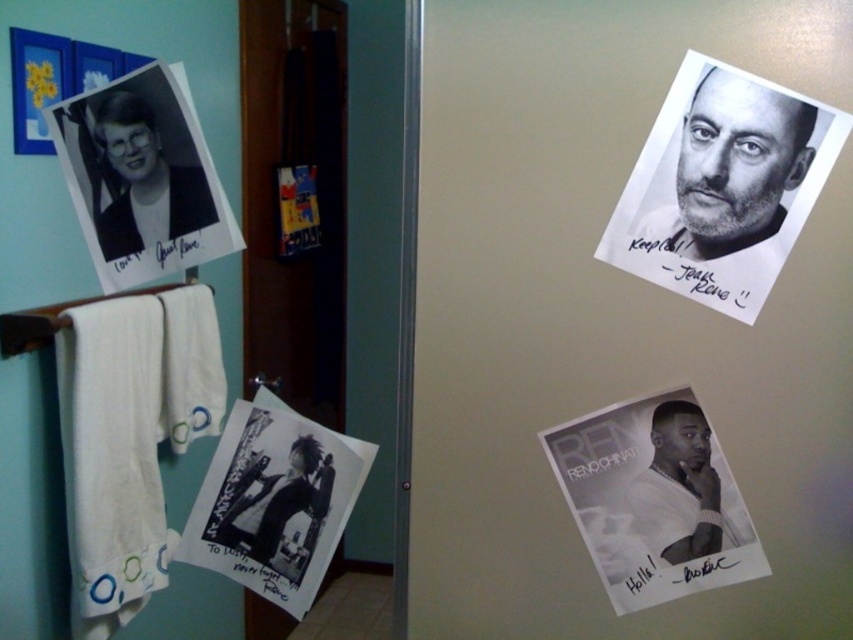
What is the position of the black paper at upper left relative to the refrigerator door?

The black paper at upper left is located at point coordinates of (x=142, y=177) on the refrigerator door.

What is the purpose of the point at coordinates (654,499) in the image?

The point at coordinates (654,499) marks the location of the black paper at lower right.